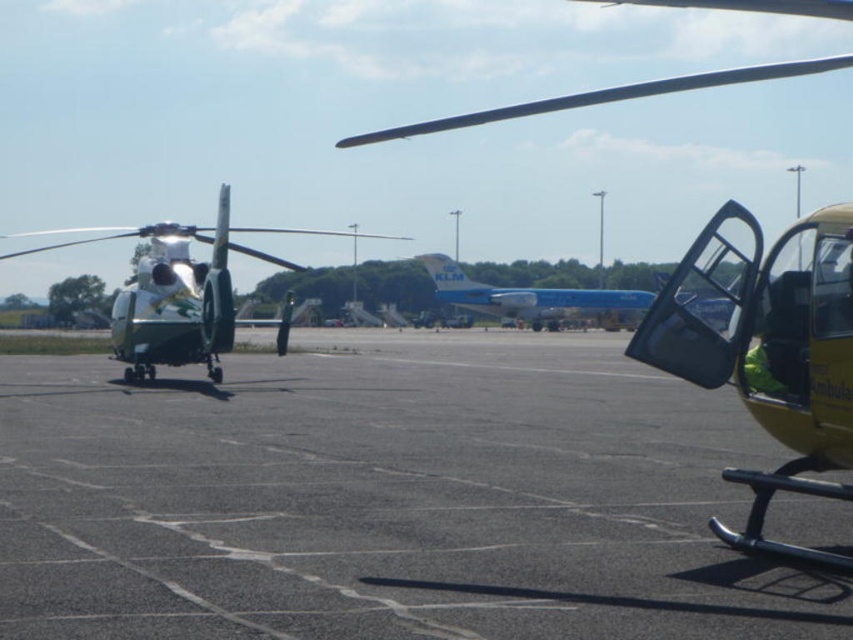
You are a pilot at the airport and need to locate your white glossy helmet at center before boarding your blue glossy airplane at center. Based on the scene, where should you look relative to the airplane?

The white glossy helmet at center is behind the blue glossy airplane at center, so you should look behind the blue glossy airplane at center to find it.

You are a maintenance worker on the airport tarmac. You need to move a tool from the white glossy helicopter at left to the white glossy helmet at center. In which direction should you move the tool?

You should move the tool to the right, as the white glossy helicopter at left is to the left of the white glossy helmet at center.

You are a maintenance worker on the airport tarmac. You need to place a new white glossy helmet at center on a shelf that can only hold items smaller than the blue glossy airplane at center. Will the helmet fit?

The blue glossy airplane at center is bigger than the white glossy helmet at center, so the helmet will fit on the shelf since it is smaller than the airplane.